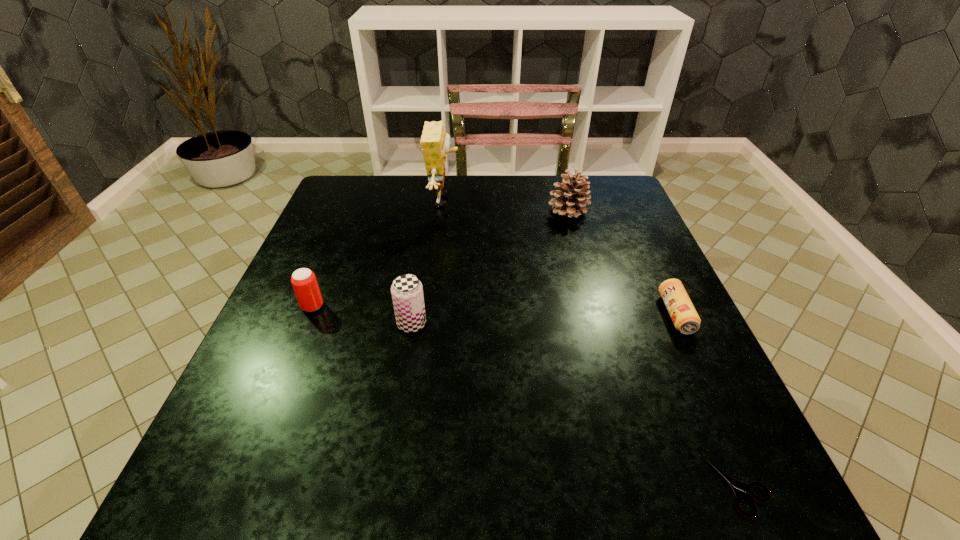
At what (x,y) coordinates should I click in order to perform the action: click on beer can that is at the right edge. Please return your answer as a coordinate pair (x, y). The width and height of the screenshot is (960, 540). Looking at the image, I should click on (686, 320).

At what (x,y) coordinates should I click in order to perform the action: click on shears that is at the right edge. Please return your answer as a coordinate pair (x, y). Looking at the image, I should click on click(x=739, y=488).

Locate an element on the screen. The width and height of the screenshot is (960, 540). object at the far right corner is located at coordinates (571, 200).

The image size is (960, 540). What are the coordinates of `object that is at the near right corner` in the screenshot? It's located at (739, 488).

Find the location of a particular element. The width and height of the screenshot is (960, 540). free space at the far edge of the desktop is located at coordinates (426, 182).

Find the location of a particular element. The height and width of the screenshot is (540, 960). vacant region at the left edge is located at coordinates (322, 228).

Where is `vacant space at the right edge of the desktop`? This screenshot has height=540, width=960. vacant space at the right edge of the desktop is located at coordinates pos(757,457).

I want to click on free space at the far left corner of the desktop, so click(372, 177).

This screenshot has width=960, height=540. In the image, there is a desktop. In order to click on vacant area at the near left corner in this screenshot , I will do `click(247, 517)`.

The width and height of the screenshot is (960, 540). I want to click on free space between the sponge and the third object from right to left, so click(506, 205).